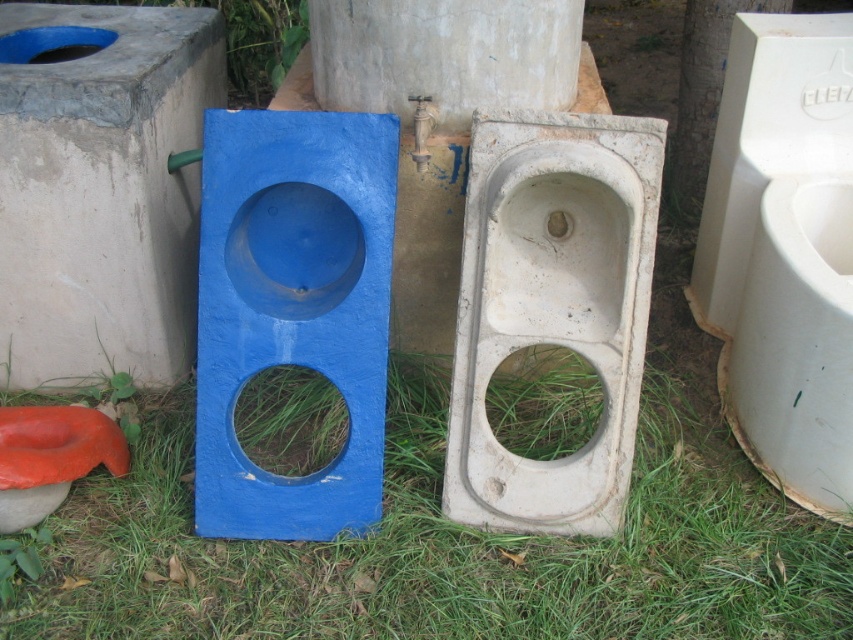
Question: Is green grass at center below white concrete urinal at center?

Choices:
 (A) no
 (B) yes

Answer: (B)

Question: Does smooth concrete wall at left have a greater width compared to white plastic urinal at right?

Choices:
 (A) yes
 (B) no

Answer: (A)

Question: Which object is farther from the camera taking this photo?

Choices:
 (A) green grass at center
 (B) white concrete urinal at center
 (C) rubberized orange toilet bowl at lower left

Answer: (C)

Question: Does green grass at center have a larger size compared to rubberized orange toilet bowl at lower left?

Choices:
 (A) no
 (B) yes

Answer: (B)

Question: Which object is positioned closest to the green grass at center?

Choices:
 (A) smooth concrete wall at left
 (B) white concrete urinal at center
 (C) white plastic urinal at right
 (D) rubberized orange toilet bowl at lower left

Answer: (B)

Question: Which of the following is the farthest from the observer?

Choices:
 (A) white plastic urinal at right
 (B) green grass at center

Answer: (A)